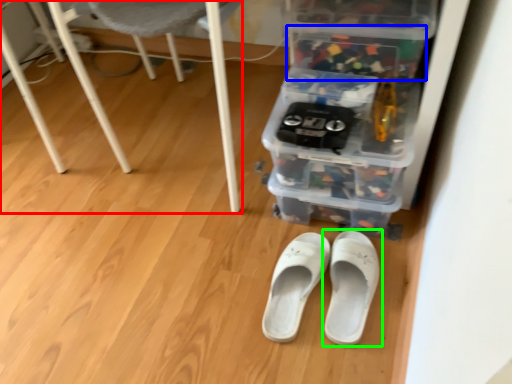
Question: Considering the real-world distances, which object is farthest from furniture (highlighted by a red box)? storage box (highlighted by a blue box) or footwear (highlighted by a green box)?

Choices:
 (A) storage box
 (B) footwear

Answer: (B)